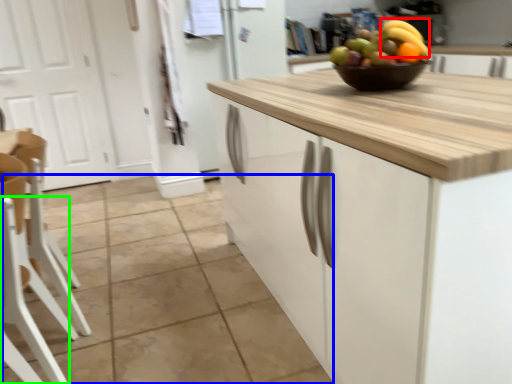
Question: Based on their relative distances, which object is farther from banana (highlighted by a red box)? Choose from tile (highlighted by a blue box) and chair (highlighted by a green box).

Choices:
 (A) tile
 (B) chair

Answer: (A)